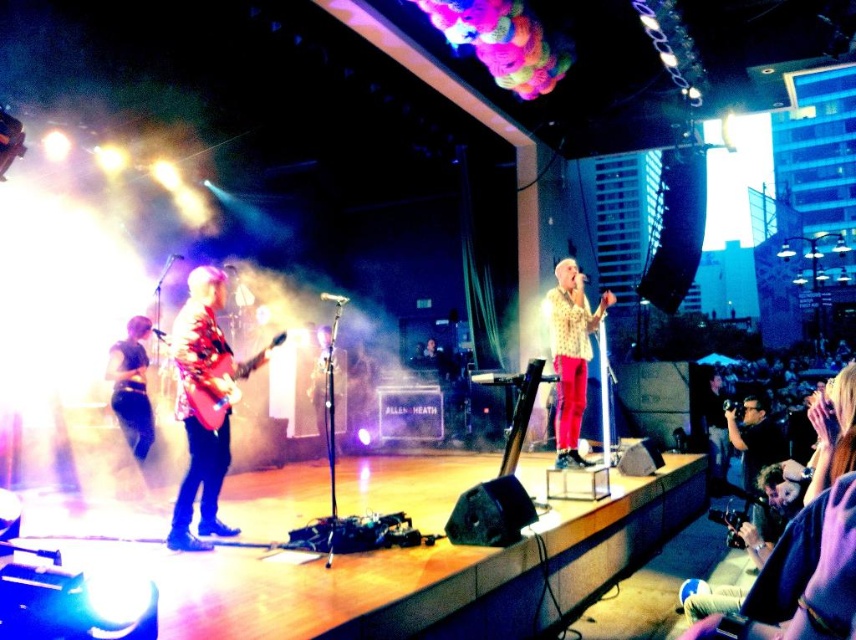
Question: Can you confirm if glossy wood guitar at left is positioned to the right of shiny red electric guitar at center-left?

Choices:
 (A) yes
 (B) no

Answer: (B)

Question: Considering the real-world distances, which object is closest to the shiny red electric guitar at center-left?

Choices:
 (A) floral-patterned shirt at center
 (B) black fabric pants at lower left
 (C) glossy wood guitar at left

Answer: (C)

Question: Does glossy wood guitar at left appear under black fabric pants at lower left?

Choices:
 (A) no
 (B) yes

Answer: (A)

Question: Does floral-patterned shirt at center appear on the left side of black fabric pants at lower left?

Choices:
 (A) yes
 (B) no

Answer: (B)

Question: Which point is farther to the camera?

Choices:
 (A) (230, 374)
 (B) (131, 449)
 (C) (189, 465)
 (D) (568, 364)

Answer: (D)

Question: Estimate the real-world distances between objects in this image. Which object is farther from the shiny red electric guitar at center-left?

Choices:
 (A) glossy wood guitar at left
 (B) floral-patterned shirt at center
 (C) black fabric pants at lower left

Answer: (B)